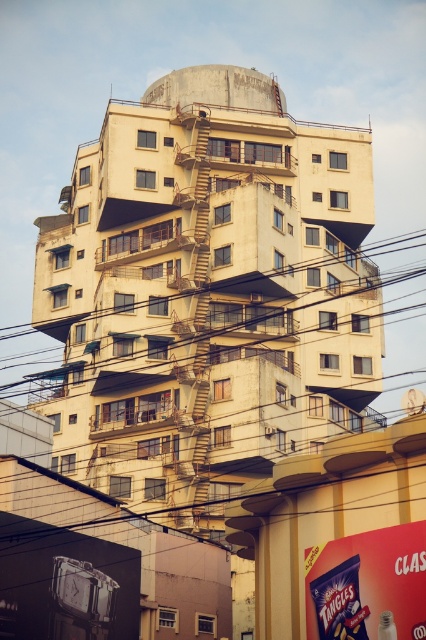
Question: Which point is farther to the camera?

Choices:
 (A) (178, 112)
 (B) (379, 252)

Answer: (B)

Question: Can you confirm if brown wire at center is positioned above yellow metal fire escape at center?

Choices:
 (A) yes
 (B) no

Answer: (B)

Question: Is brown wire at center bigger than yellow metal fire escape at center?

Choices:
 (A) no
 (B) yes

Answer: (B)

Question: Among these points, which one is nearest to the camera?

Choices:
 (A) (196, 195)
 (B) (5, 374)

Answer: (A)

Question: Is brown wire at center below yellow metal fire escape at center?

Choices:
 (A) no
 (B) yes

Answer: (B)